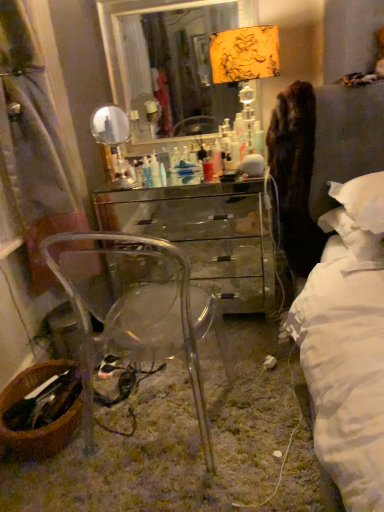
Question: Considering the positions of floral fabric lampshade at upper center and translucent plastic container at center in the image, is floral fabric lampshade at upper center bigger or smaller than translucent plastic container at center?

Choices:
 (A) small
 (B) big

Answer: (B)

Question: Relative to translucent plastic container at center, is floral fabric lampshade at upper center in front or behind?

Choices:
 (A) behind
 (B) front

Answer: (B)

Question: Which of these objects is positioned farthest from the floral fabric lampshade at upper center?

Choices:
 (A) glossy mirrored chest of drawers at center
 (B) white soft pillow at right, acting as the 1th pillow starting from the bottom
 (C) metallic silver mirror at upper center
 (D) translucent plastic container at center
 (E) transparent acrylic chair at center

Answer: (E)

Question: Which object is positioned farthest from the metallic silver mirror at upper center?

Choices:
 (A) glossy mirrored chest of drawers at center
 (B) translucent plastic container at center
 (C) floral fabric lampshade at upper center
 (D) white soft pillow at right, acting as the 1th pillow starting from the bottom
 (E) transparent acrylic chair at center

Answer: (D)